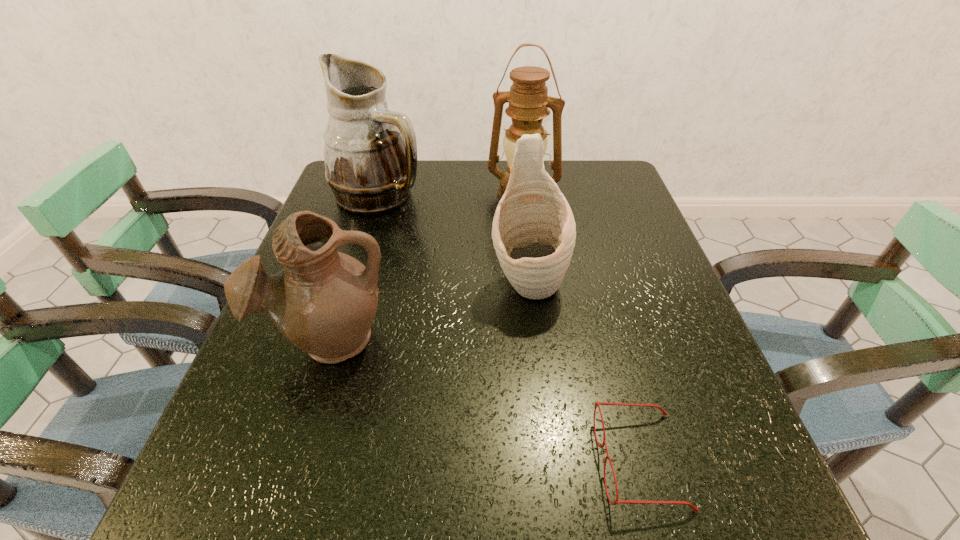
Locate which object ranks in proximity to the oil lamp. Please provide its 2D coordinates. Your answer should be formatted as a tuple, i.e. [(x, y)], where the tuple contains the x and y coordinates of a point satisfying the conditions above.

[(370, 153)]

Locate an element on the screen. The height and width of the screenshot is (540, 960). object that stands as the closest to the oil lamp is located at coordinates (370, 153).

Find the location of a particular element. The width and height of the screenshot is (960, 540). the second closest pitcher to the nearest object is located at coordinates (324, 302).

Locate an element on the screen. pitcher that is the second closest one to the rightmost pitcher is located at coordinates (370, 153).

Identify the location of vacant space that satisfies the following two spatial constraints: 1. from the spout of the farthest pitcher; 2. at the spout of the fourth tallest object. The height and width of the screenshot is (540, 960). (336, 339).

The width and height of the screenshot is (960, 540). I want to click on vacant point that satisfies the following two spatial constraints: 1. from the spout of the farthest pitcher; 2. at the spout of the shortest pitcher, so click(x=336, y=339).

Image resolution: width=960 pixels, height=540 pixels. Identify the location of blank area in the image that satisfies the following two spatial constraints: 1. from the spout of the farthest pitcher; 2. at the spout of the second shortest object. (336, 339).